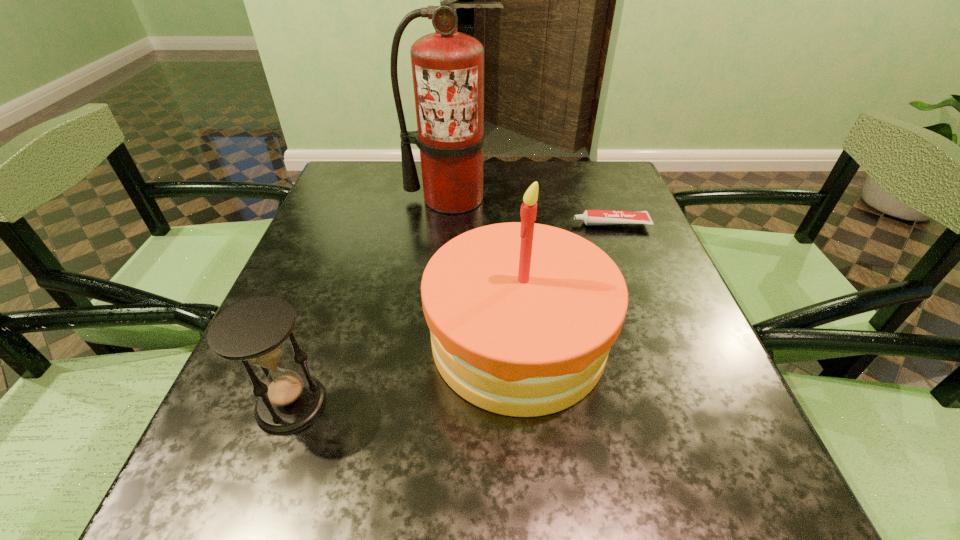
Image resolution: width=960 pixels, height=540 pixels. I want to click on free space located 0.400m at the nozzle of the third nearest object, so click(x=405, y=224).

Identify the location of vacant space located at the nozzle of the third nearest object. (444, 224).

Find the location of a particular element. free space located at the nozzle of the third nearest object is located at coordinates (430, 224).

You are a GUI agent. You are given a task and a screenshot of the screen. Output one action in this format:
    pyautogui.click(x=<x>, y=<y>)
    Task: Click on the object that is positioned at the far edge
    This screenshot has width=960, height=540.
    Given the screenshot: What is the action you would take?
    pyautogui.click(x=447, y=66)

This screenshot has width=960, height=540. Find the location of `object that is at the left edge`. object that is at the left edge is located at coordinates (254, 330).

Identify the location of object located at the right edge. (590, 217).

You are a GUI agent. You are given a task and a screenshot of the screen. Output one action in this format:
    pyautogui.click(x=<x>, y=<y>)
    Task: Click on the vacant region at the far edge of the desktop
    The image size is (960, 540).
    Given the screenshot: What is the action you would take?
    pyautogui.click(x=510, y=160)

Locate an element on the screen. The height and width of the screenshot is (540, 960). free point at the near edge is located at coordinates (652, 494).

Where is `blank space at the left edge of the desktop`? The height and width of the screenshot is (540, 960). blank space at the left edge of the desktop is located at coordinates (357, 251).

Where is `vacant space at the right edge of the desktop`? Image resolution: width=960 pixels, height=540 pixels. vacant space at the right edge of the desktop is located at coordinates (663, 320).